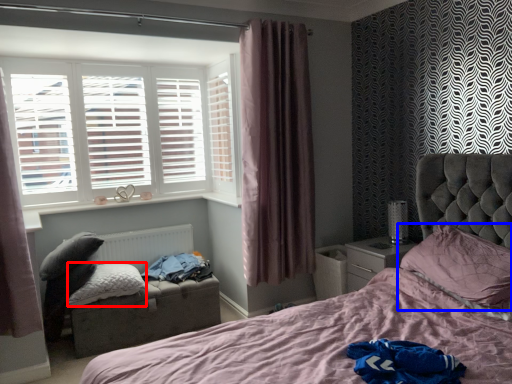
Question: Which point is further to the camera, pillow (highlighted by a red box) or pillow (highlighted by a blue box)?

Choices:
 (A) pillow
 (B) pillow

Answer: (A)